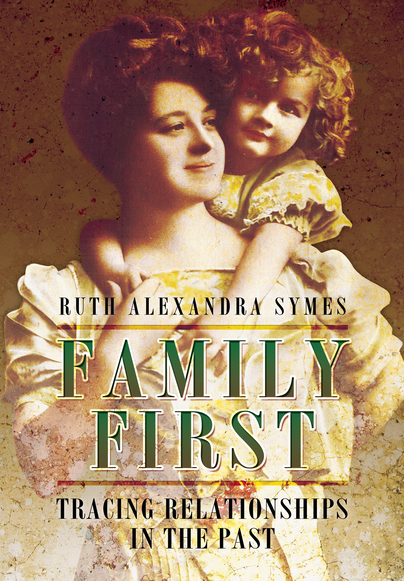
Locate an element on the screen. This screenshot has width=404, height=581. book is located at coordinates (366, 572).